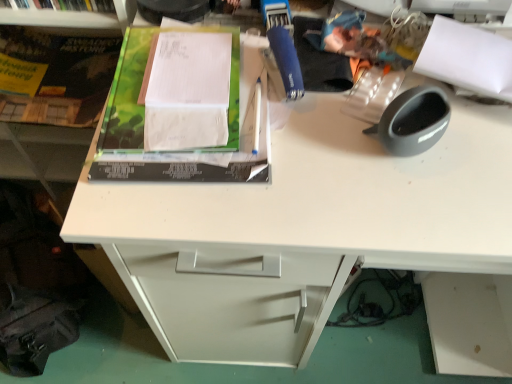
Question: From the image's perspective, is green matte paper at upper left, the 2th paperback book viewed from the back, above white plastic shelf at upper left?

Choices:
 (A) yes
 (B) no

Answer: (B)

Question: Is green matte paper at upper left, the second paperback book when ordered from left to right, far away from white plastic shelf at upper left?

Choices:
 (A) yes
 (B) no

Answer: (B)

Question: Does green matte paper at upper left, arranged as the 1th paperback book when viewed from the right, have a lesser height compared to white plastic shelf at upper left?

Choices:
 (A) yes
 (B) no

Answer: (A)

Question: Considering the relative sizes of green matte paper at upper left, the second paperback book when ordered from left to right, and white plastic shelf at upper left in the image provided, is green matte paper at upper left, the second paperback book when ordered from left to right, wider than white plastic shelf at upper left?

Choices:
 (A) no
 (B) yes

Answer: (B)

Question: Considering the relative sizes of green matte paper at upper left, the 2th paperback book viewed from the back, and white plastic shelf at upper left in the image provided, is green matte paper at upper left, the 2th paperback book viewed from the back, bigger than white plastic shelf at upper left?

Choices:
 (A) no
 (B) yes

Answer: (A)

Question: Is green matte paper at upper left, arranged as the 1th paperback book when viewed from the right, at the right side of white plastic shelf at upper left?

Choices:
 (A) yes
 (B) no

Answer: (A)

Question: Considering the relative sizes of white plastic shelf at upper left and green matte paper at upper left, marked as the first paperback book in a front-to-back arrangement, in the image provided, is white plastic shelf at upper left wider than green matte paper at upper left, marked as the first paperback book in a front-to-back arrangement,?

Choices:
 (A) no
 (B) yes

Answer: (A)

Question: Does white plastic shelf at upper left have a smaller size compared to green matte paper at upper left, the 2th paperback book viewed from the back?

Choices:
 (A) yes
 (B) no

Answer: (B)

Question: From a real-world perspective, is white plastic shelf at upper left under green matte paper at upper left, marked as the first paperback book in a front-to-back arrangement?

Choices:
 (A) yes
 (B) no

Answer: (B)

Question: From the image's perspective, does white plastic shelf at upper left appear higher than green matte paper at upper left, arranged as the 1th paperback book when viewed from the right?

Choices:
 (A) yes
 (B) no

Answer: (A)

Question: From a real-world perspective, does white plastic shelf at upper left stand above green matte paper at upper left, the second paperback book when ordered from left to right?

Choices:
 (A) no
 (B) yes

Answer: (B)

Question: Is white plastic shelf at upper left directly adjacent to green matte paper at upper left, the 2th paperback book viewed from the back?

Choices:
 (A) no
 (B) yes

Answer: (A)

Question: Is green matte book at upper left facing away from green matte paper at upper left, arranged as the 1th paperback book when viewed from the right?

Choices:
 (A) no
 (B) yes

Answer: (A)